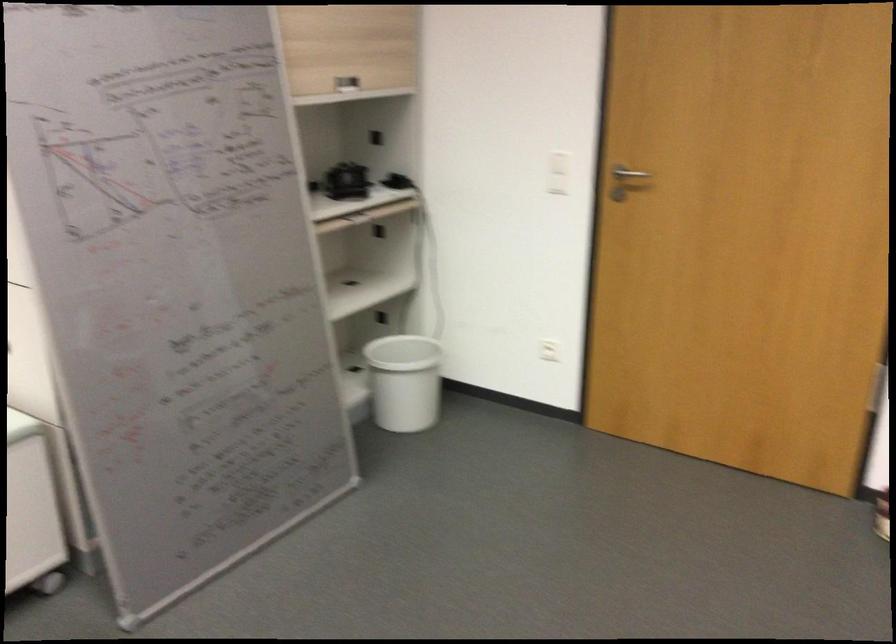
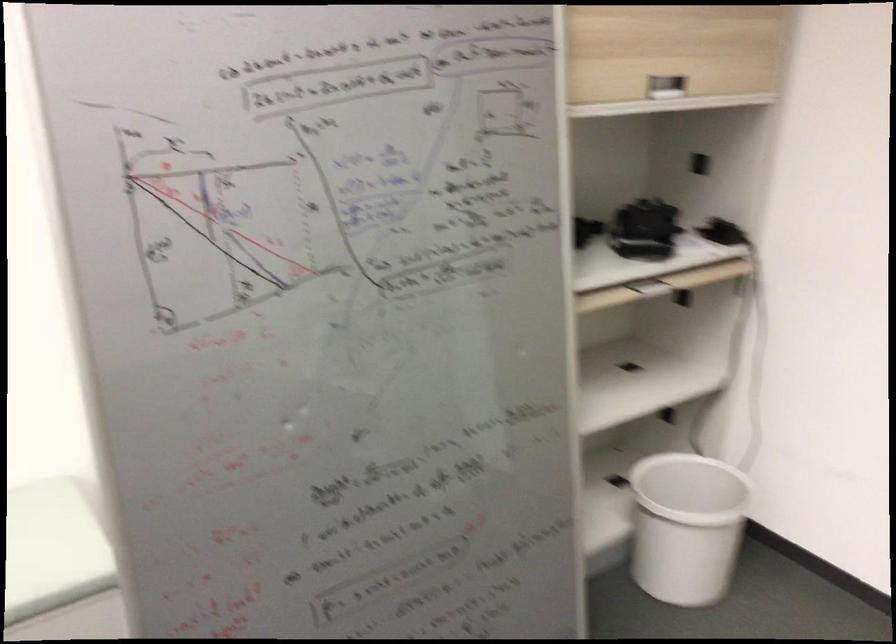
Find the pixel in the second image that matches (373,236) in the first image.

(675, 303)